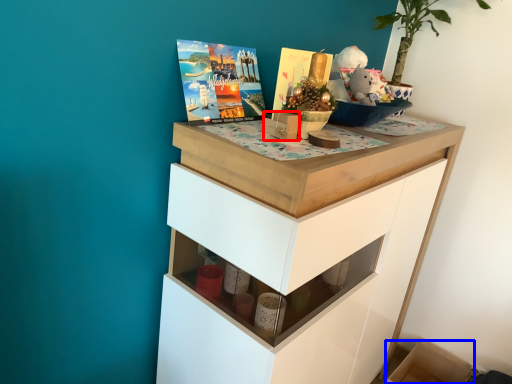
Question: Which object is further to the camera taking this photo, box (highlighted by a red box) or cabinetry (highlighted by a blue box)?

Choices:
 (A) box
 (B) cabinetry

Answer: (B)